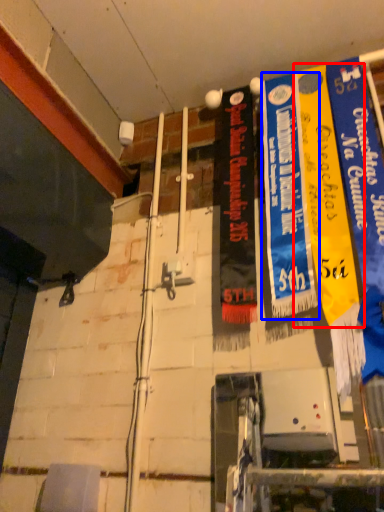
Question: Which object is closer to the camera taking this photo, poster (highlighted by a red box) or poster (highlighted by a blue box)?

Choices:
 (A) poster
 (B) poster

Answer: (A)